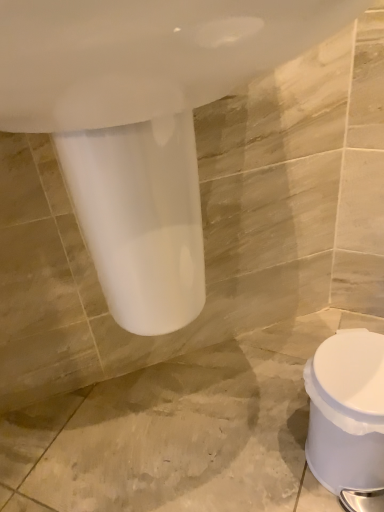
The width and height of the screenshot is (384, 512). What do you see at coordinates (347, 411) in the screenshot?
I see `white plastic toilet at lower right` at bounding box center [347, 411].

What is the approximate width of white plastic toilet at lower right?

white plastic toilet at lower right is 8.75 inches in width.

Measure the distance between point (383, 442) and camera.

25.08 inches.

Find the location of `white plastic toilet at lower right`. white plastic toilet at lower right is located at coordinates (347, 411).

The image size is (384, 512). Find the location of `white glossy sink at upper center`. white glossy sink at upper center is located at coordinates (141, 98).

Measure the distance between point [119,10] and camera.

Point [119,10] and camera are 24.80 centimeters apart.

What do you see at coordinates (141, 98) in the screenshot? I see `white glossy sink at upper center` at bounding box center [141, 98].

You are a GUI agent. You are given a task and a screenshot of the screen. Output one action in this format:
    pyautogui.click(x=<x>, y=<y>)
    Task: Click on the white plastic toilet at lower right
    This screenshot has height=512, width=384.
    Given the screenshot: What is the action you would take?
    pyautogui.click(x=347, y=411)

Considering the relative positions of white glossy sink at upper center and white plastic toilet at lower right in the image provided, is white glossy sink at upper center to the left of white plastic toilet at lower right from the viewer's perspective?

Correct, you'll find white glossy sink at upper center to the left of white plastic toilet at lower right.

Is the position of white glossy sink at upper center less distant than that of white plastic toilet at lower right?

Yes, white glossy sink at upper center is closer to the camera.

Does point (189, 239) lie behind point (347, 390)?

No, it is in front of (347, 390).

From the image's perspective, which one is positioned higher, white glossy sink at upper center or white plastic toilet at lower right?

white glossy sink at upper center.

From a real-world perspective, is white glossy sink at upper center under white plastic toilet at lower right?

Incorrect, from a real-world perspective, white glossy sink at upper center is higher than white plastic toilet at lower right.

Is white glossy sink at upper center thinner than white plastic toilet at lower right?

In fact, white glossy sink at upper center might be wider than white plastic toilet at lower right.

Looking at this image, who is shorter, white glossy sink at upper center or white plastic toilet at lower right?

white plastic toilet at lower right.

Considering the relative sizes of white glossy sink at upper center and white plastic toilet at lower right in the image provided, is white glossy sink at upper center bigger than white plastic toilet at lower right?

Yes.

Is white plastic toilet at lower right completely or partially inside white glossy sink at upper center?

No, white plastic toilet at lower right is not a part of white glossy sink at upper center.

Is white glossy sink at upper center next to white plastic toilet at lower right?

white glossy sink at upper center is not next to white plastic toilet at lower right, and they're not touching.

Is white glossy sink at upper center facing towards white plastic toilet at lower right?

No, white glossy sink at upper center is not facing towards white plastic toilet at lower right.

Based on the photo, how much distance is there between white glossy sink at upper center and white plastic toilet at lower right?

They are 16.20 inches apart.

The height and width of the screenshot is (512, 384). In order to click on bath above the white plastic toilet at lower right (from a real-world perspective) in this screenshot , I will do `click(141, 98)`.

Is white plastic toilet at lower right to the left of white glossy sink at upper center from the viewer's perspective?

No, white plastic toilet at lower right is not to the left of white glossy sink at upper center.

Does white plastic toilet at lower right lie behind white glossy sink at upper center?

Yes, the depth of white plastic toilet at lower right is greater than that of white glossy sink at upper center.

Which point is more distant from viewer, [375,426] or [115,267]?

The point [375,426] is behind.

From the image's perspective, between white plastic toilet at lower right and white glossy sink at upper center, who is located below?

white plastic toilet at lower right is shown below in the image.

From a real-world perspective, between white plastic toilet at lower right and white glossy sink at upper center, who is vertically lower?

white plastic toilet at lower right is physically lower.

Considering the sizes of white plastic toilet at lower right and white glossy sink at upper center in the image, is white plastic toilet at lower right wider or thinner than white glossy sink at upper center?

white plastic toilet at lower right is thinner than white glossy sink at upper center.

Can you confirm if white plastic toilet at lower right is taller than white glossy sink at upper center?

In fact, white plastic toilet at lower right may be shorter than white glossy sink at upper center.

Considering the sizes of objects white plastic toilet at lower right and white glossy sink at upper center in the image provided, who is bigger, white plastic toilet at lower right or white glossy sink at upper center?

Bigger between the two is white glossy sink at upper center.

Based on the photo, is white plastic toilet at lower right completely or partially outside of white glossy sink at upper center?

white plastic toilet at lower right is positioned outside white glossy sink at upper center.

Are white plastic toilet at lower right and white glossy sink at upper center making contact?

No, white plastic toilet at lower right is not in contact with white glossy sink at upper center.

Is white plastic toilet at lower right turned away from white glossy sink at upper center?

That's not correct — white plastic toilet at lower right is not looking away from white glossy sink at upper center.

Can you tell me how much white plastic toilet at lower right and white glossy sink at upper center differ in facing direction?

11.5 degrees.

Measure the distance from white plastic toilet at lower right to white glossy sink at upper center.

white plastic toilet at lower right is 16.20 inches from white glossy sink at upper center.

You are a GUI agent. You are given a task and a screenshot of the screen. Output one action in this format:
    pyautogui.click(x=<x>, y=<y>)
    Task: Click on the toilet behind the white glossy sink at upper center
    The image size is (384, 512).
    Given the screenshot: What is the action you would take?
    pyautogui.click(x=347, y=411)

The height and width of the screenshot is (512, 384). Find the location of `bath in front of the white plastic toilet at lower right`. bath in front of the white plastic toilet at lower right is located at coordinates (141, 98).

This screenshot has height=512, width=384. Identify the location of bath to the left of white plastic toilet at lower right. (141, 98).